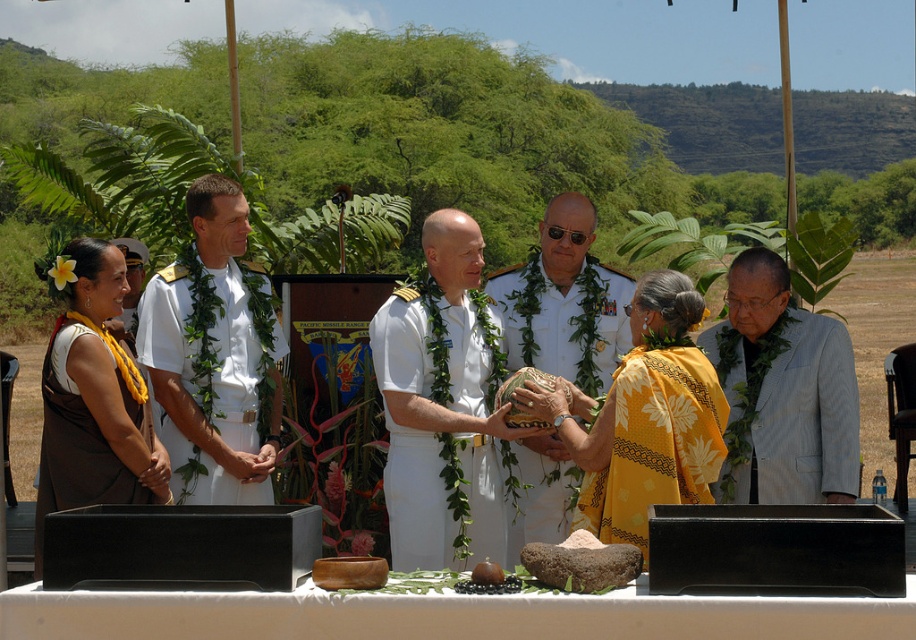
In the scene shown: You are standing at a point where you can see both point (x=690, y=376) and point (x=77, y=435). Which point is closer to you?

Point (x=690, y=376) is in front of point (x=77, y=435), so it is closer to you.

You are a photographer standing at the edge of the scene. You want to capture a photo where the white cotton lei at center is centered in the frame. Which direction should you move your camera to align the lei with the center of the photo?

The white cotton lei at center is already at point (442, 497), which is close to the center of the frame. However, since the exact center would be at coordinates like (458, 320), you should move your camera slightly to the left and up to bring the lei closer to the true center.